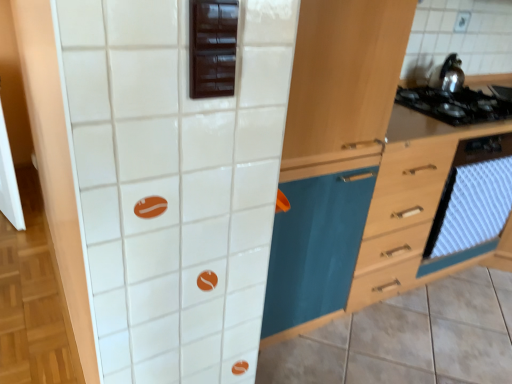
Image resolution: width=512 pixels, height=384 pixels. I want to click on wooden cabinet at center, so click(x=332, y=152).

The height and width of the screenshot is (384, 512). I want to click on dark brown wooden cabinet at upper center, so (212, 47).

The width and height of the screenshot is (512, 384). I want to click on black glass stove at upper right, so click(x=435, y=126).

Between wooden drawer at right and dark brown wooden cabinet at upper center, which one has larger size?

wooden drawer at right.

Find the location of a particular element. The image size is (512, 384). appliance on the left of wooden drawer at right is located at coordinates click(212, 47).

Between wooden drawer at right and dark brown wooden cabinet at upper center, which one appears on the right side from the viewer's perspective?

Positioned to the right is wooden drawer at right.

Is wooden drawer at right not inside dark brown wooden cabinet at upper center?

Yes, wooden drawer at right is located beyond the bounds of dark brown wooden cabinet at upper center.

Is white textured oven at right closer to camera compared to dark brown wooden cabinet at upper center?

No, white textured oven at right is further to the viewer.

Is dark brown wooden cabinet at upper center located within white textured oven at right?

No, dark brown wooden cabinet at upper center is located outside of white textured oven at right.

Can you confirm if white textured oven at right is bigger than dark brown wooden cabinet at upper center?

Indeed, white textured oven at right has a larger size compared to dark brown wooden cabinet at upper center.

Between white textured oven at right and dark brown wooden cabinet at upper center, which one appears on the left side from the viewer's perspective?

From the viewer's perspective, dark brown wooden cabinet at upper center appears more on the left side.

From a real-world perspective, between dark brown wooden cabinet at upper center and black glass stove at upper right, who is vertically lower?

From a 3D spatial view, black glass stove at upper right is below.

Is dark brown wooden cabinet at upper center facing away from black glass stove at upper right?

That's not correct — dark brown wooden cabinet at upper center is not looking away from black glass stove at upper right.

Which is more distant, (x=232, y=22) or (x=472, y=126)?

The point (x=472, y=126) is more distant.

Between point (475, 184) and point (360, 244), which one is positioned behind?

Positioned behind is point (475, 184).

Is white textured oven at right inside the boundaries of wooden cabinet at center, or outside?

white textured oven at right is spatially situated outside wooden cabinet at center.

Considering the relative positions of white textured oven at right and wooden cabinet at center in the image provided, is white textured oven at right behind wooden cabinet at center?

Yes, white textured oven at right is further from the camera.

Is white textured oven at right turned away from wooden cabinet at center?

No, white textured oven at right is not facing the opposite direction of wooden cabinet at center.

From the picture: Which object is further away from the camera, black glass stove at upper right or shiny metallic kettle at upper right?

shiny metallic kettle at upper right is behind.

Is the surface of black glass stove at upper right in direct contact with shiny metallic kettle at upper right?

No.

Who is shorter, black glass stove at upper right or shiny metallic kettle at upper right?

With less height is black glass stove at upper right.

Based on the photo, from the image's perspective, which one is positioned lower, shiny metallic kettle at upper right or black glass stove at upper right?

black glass stove at upper right is shown below in the image.

Can you confirm if shiny metallic kettle at upper right is positioned to the left of black glass stove at upper right?

Incorrect, shiny metallic kettle at upper right is not on the left side of black glass stove at upper right.

Which object is closer to the camera taking this photo, shiny metallic kettle at upper right or black glass stove at upper right?

Positioned in front is black glass stove at upper right.

Is black glass stove at upper right located within shiny metallic kettle at upper right?

Definitely not — black glass stove at upper right is not inside shiny metallic kettle at upper right.

From a real-world perspective, is black glass stove at upper right on white textured oven at right?

Yes, from a real-world perspective, black glass stove at upper right is on top of white textured oven at right.

Is black glass stove at upper right far from white textured oven at right?

That's not correct — black glass stove at upper right is a little close to white textured oven at right.

Considering the positions of point (483, 135) and point (486, 251), is point (483, 135) closer or farther from the camera than point (486, 251)?

Point (483, 135).

Would you say white textured oven at right is part of black glass stove at upper right's contents?

No, white textured oven at right is located outside of black glass stove at upper right.

The height and width of the screenshot is (384, 512). I want to click on file cabinet below the dark brown wooden cabinet at upper center (from a real-world perspective), so click(416, 207).

In the image, there is a white textured oven at right. Identify the location of appliance above it (from the image's perspective). The width and height of the screenshot is (512, 384). (212, 47).

Estimate the real-world distances between objects in this image. Which object is closer to white textured oven at right, wooden cabinet at center or shiny metallic kettle at upper right?

shiny metallic kettle at upper right.

Estimate the real-world distances between objects in this image. Which object is further from black glass stove at upper right, wooden drawer at right or white textured oven at right?

white textured oven at right.

In the scene shown: Which object lies further to the anchor point shiny metallic kettle at upper right, black glass stove at upper right or wooden drawer at right?

Based on the image, wooden drawer at right appears to be further to shiny metallic kettle at upper right.

Considering their positions, is shiny metallic kettle at upper right positioned closer to wooden cabinet at center than wooden drawer at right?

wooden drawer at right.

Which object lies further to the anchor point white textured oven at right, wooden drawer at right or wooden cabinet at center?

Among the two, wooden cabinet at center is located further to white textured oven at right.

Looking at the image, which one is located closer to wooden drawer at right, wooden cabinet at center or dark brown wooden cabinet at upper center?

wooden cabinet at center lies closer to wooden drawer at right than the other object.

In the scene shown: Estimate the real-world distances between objects in this image. Which object is closer to wooden cabinet at center, white textured oven at right or wooden drawer at right?

wooden drawer at right is positioned closer to the anchor wooden cabinet at center.

From the image, which object appears to be farther from wooden drawer at right, wooden cabinet at center or white textured oven at right?

Among the two, wooden cabinet at center is located further to wooden drawer at right.

Image resolution: width=512 pixels, height=384 pixels. I want to click on kitchen appliance situated between wooden cabinet at center and white textured oven at right from left to right, so click(x=448, y=75).

You are a GUI agent. You are given a task and a screenshot of the screen. Output one action in this format:
    pyautogui.click(x=<x>, y=<y>)
    Task: Click on the counter top that lies between shiny metallic kettle at upper right and wooden drawer at right from top to bottom
    The height and width of the screenshot is (384, 512).
    Given the screenshot: What is the action you would take?
    pyautogui.click(x=435, y=126)

Where is `counter top between shiny metallic kettle at upper right and white textured oven at right in the up-down direction`? counter top between shiny metallic kettle at upper right and white textured oven at right in the up-down direction is located at coordinates [x=435, y=126].

Find the location of a particular element. This screenshot has height=384, width=512. counter top between wooden cabinet at center and wooden drawer at right from left to right is located at coordinates (435, 126).